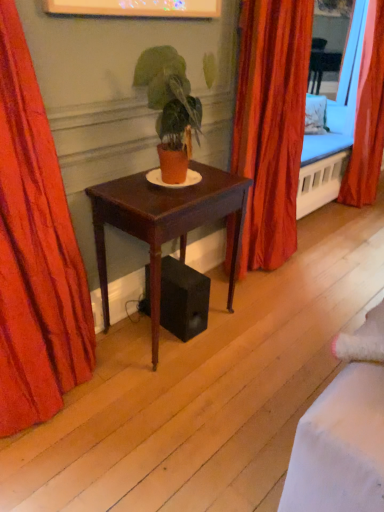
At what (x,y) coordinates should I click in order to perform the action: click on free space below mahogany wood desk at center (from a real-world perspective). Please return your answer as a coordinate pair (x, y). Looking at the image, I should click on (145, 326).